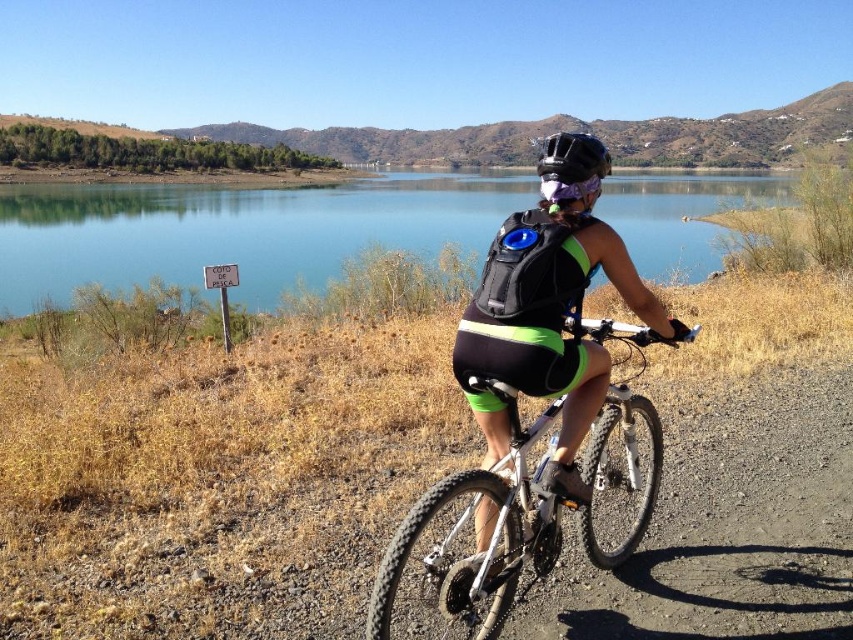
Question: Is blue water at center to the right of purple matte goggles at center from the viewer's perspective?

Choices:
 (A) yes
 (B) no

Answer: (A)

Question: Among these points, which one is farthest from the camera?

Choices:
 (A) (582, 161)
 (B) (543, 189)
 (C) (692, 237)
 (D) (383, 637)

Answer: (C)

Question: Does white metallic bicycle at center appear under purple matte goggles at center?

Choices:
 (A) yes
 (B) no

Answer: (A)

Question: Based on their relative distances, which object is nearer to the black matte helmet at center?

Choices:
 (A) blue water at center
 (B) black matte cycling shorts at center
 (C) purple matte goggles at center

Answer: (B)

Question: Which of the following is the farthest from the observer?

Choices:
 (A) (590, 182)
 (B) (593, 417)

Answer: (B)

Question: Does white metallic bicycle at center have a lesser width compared to purple matte goggles at center?

Choices:
 (A) yes
 (B) no

Answer: (B)